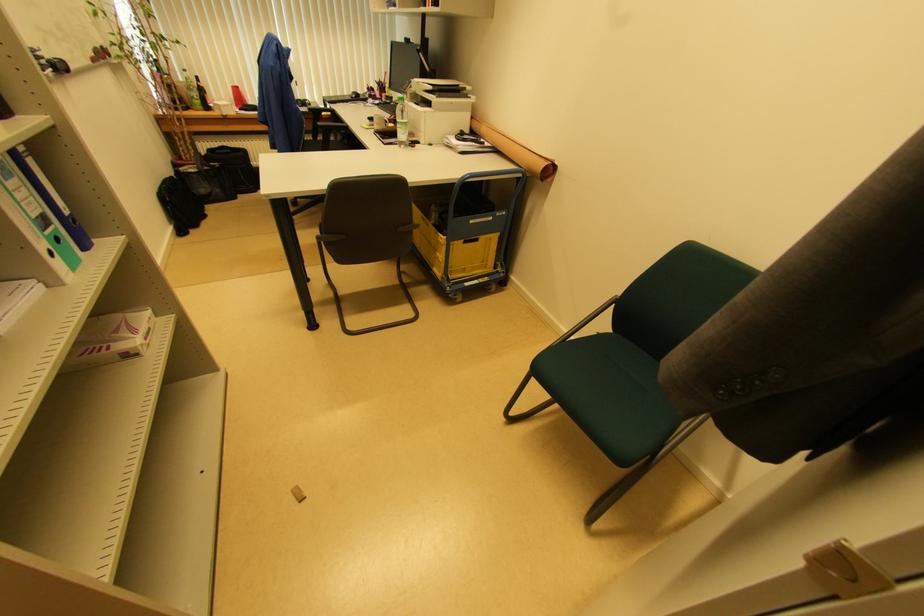
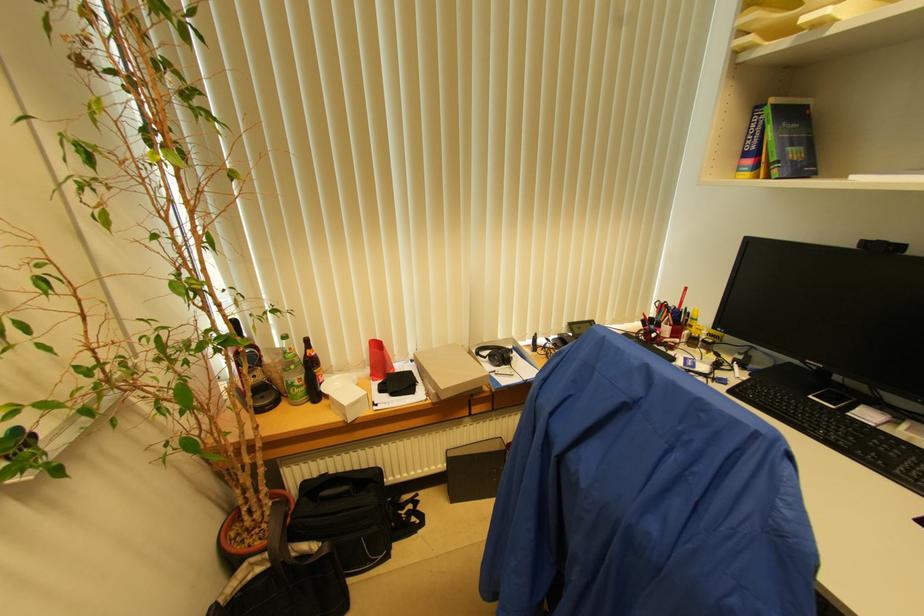
Locate, in the second image, the point that corresponds to [200,98] in the first image.

(304, 379)